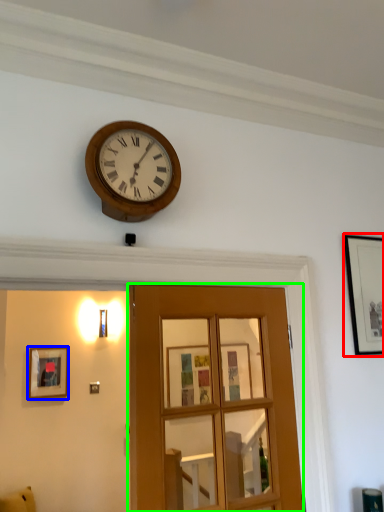
Question: Which is nearer to the picture frame (highlighted by a red box)? picture frame (highlighted by a blue box) or door (highlighted by a green box).

Choices:
 (A) picture frame
 (B) door

Answer: (B)